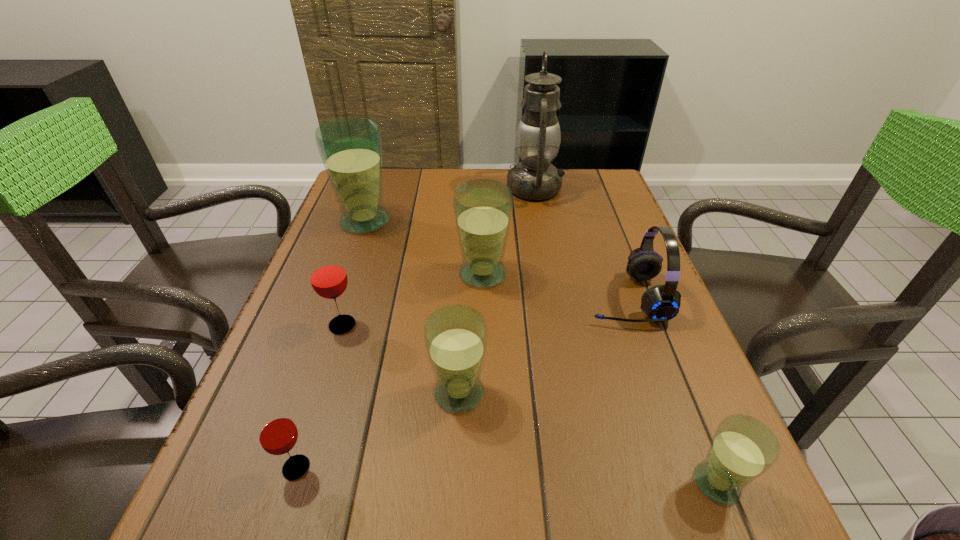
Locate an element on the screen. The width and height of the screenshot is (960, 540). oil lamp is located at coordinates (538, 136).

Find the location of a particular element. the farthest glass is located at coordinates (350, 148).

The image size is (960, 540). In order to click on the farthest blue glass in this screenshot , I will do `click(350, 148)`.

You are a GUI agent. You are given a task and a screenshot of the screen. Output one action in this format:
    pyautogui.click(x=<x>, y=<y>)
    Task: Click on the fifth shortest glass
    The height and width of the screenshot is (540, 960).
    Given the screenshot: What is the action you would take?
    pyautogui.click(x=483, y=208)

Identify the location of the third smallest blue glass. (483, 208).

At what (x,y) coordinates should I click in order to perform the action: click on headset. Please return your answer as a coordinate pair (x, y). This screenshot has height=540, width=960. Looking at the image, I should click on (660, 303).

This screenshot has height=540, width=960. I want to click on the farther red glass, so click(328, 277).

Where is `the bigger red glass`? the bigger red glass is located at coordinates (328, 277).

The image size is (960, 540). Find the location of `the second nearest blue glass`. the second nearest blue glass is located at coordinates (455, 336).

Locate an element on the screen. the third nearest object is located at coordinates (455, 336).